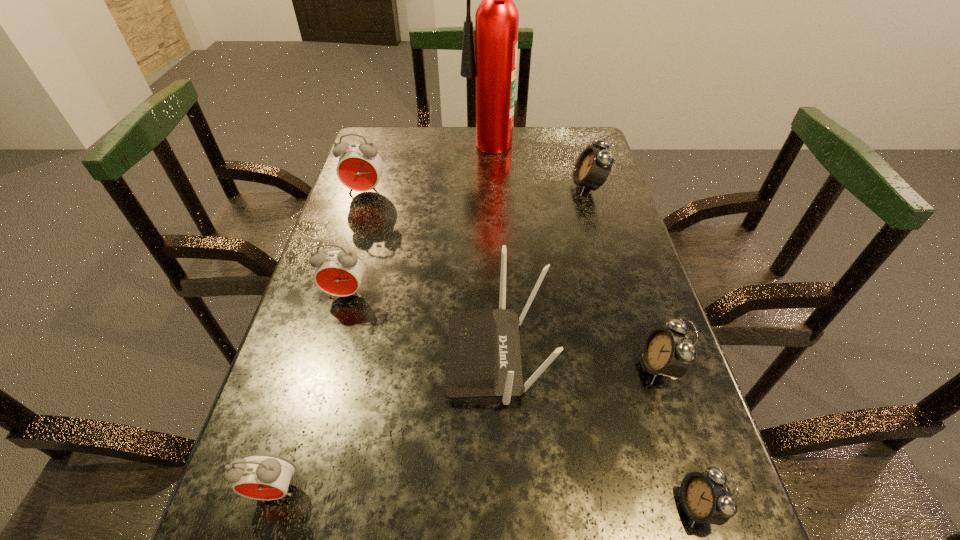
This screenshot has width=960, height=540. In order to click on object present at the far edge in this screenshot , I will do `click(497, 18)`.

Find the location of a particular element. Image resolution: width=960 pixels, height=540 pixels. vacant space at the far edge of the desktop is located at coordinates (495, 156).

Image resolution: width=960 pixels, height=540 pixels. I want to click on vacant space at the left edge, so click(x=325, y=399).

At what (x,y) coordinates should I click in order to perform the action: click on vacant space at the right edge of the desktop. Please return your answer as a coordinate pair (x, y). This screenshot has width=960, height=540. Looking at the image, I should click on click(599, 219).

In the image, there is a desktop. Where is `vacant region at the far left corner`? The height and width of the screenshot is (540, 960). vacant region at the far left corner is located at coordinates (410, 133).

Where is `vacant region between the third farthest alarm clock and the smallest red alarm clock`? This screenshot has width=960, height=540. vacant region between the third farthest alarm clock and the smallest red alarm clock is located at coordinates (310, 392).

The image size is (960, 540). What are the coordinates of `free spot between the router and the shortest object` in the screenshot? It's located at (597, 431).

Locate an element on the screen. This screenshot has width=960, height=540. free spot between the router and the smallest white alarm clock is located at coordinates (597, 431).

Where is `vacant area that lies between the smallest red alarm clock and the shortest alarm clock`? This screenshot has height=540, width=960. vacant area that lies between the smallest red alarm clock and the shortest alarm clock is located at coordinates (486, 498).

The image size is (960, 540). I want to click on free spot between the fourth nearest alarm clock and the farthest red alarm clock, so click(x=355, y=243).